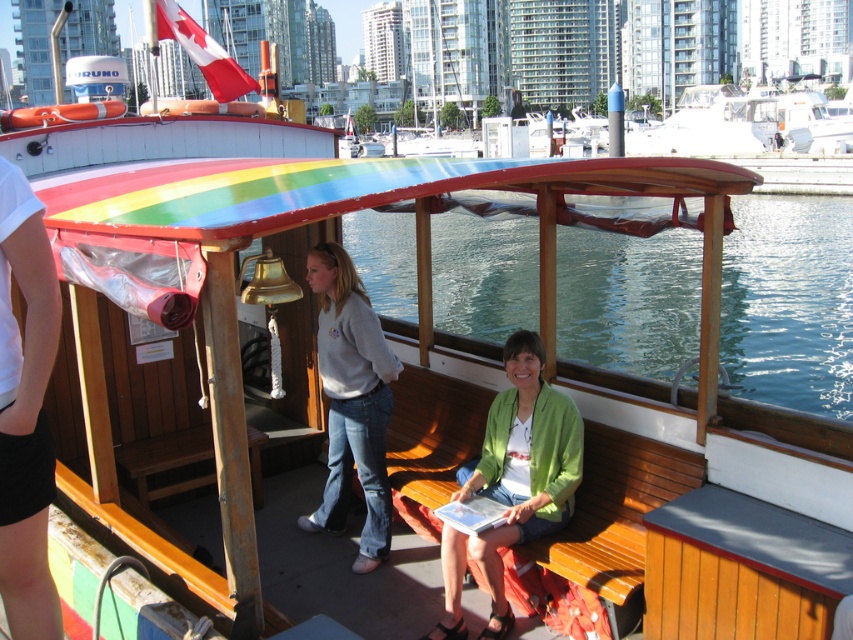
You are a passenger on the boat and want to place your 30cm wide backpack on the deck. The deck has the transparent glass water at center and the green fabric jacket at center. Which object can you place your backpack next to without overlapping?

The transparent glass water at center has a larger width than the green fabric jacket at center, so placing the backpack next to the transparent glass water at center would provide more space and prevent overlapping.

Consider the image. You are standing on the deck of the boat and want to place a small item at point (x=514, y=481). Which object is located at that coordinate?

The point (x=514, y=481) is on the green fabric jacket at center.

You are a passenger on the boat and want to place a small backpack between the transparent glass water at center and the gray sweatshirt at center. Which object should you place it closer to if you want the backpack to be near the larger object?

You should place the backpack closer to the transparent glass water at center because it has a larger size compared to the gray sweatshirt at center.